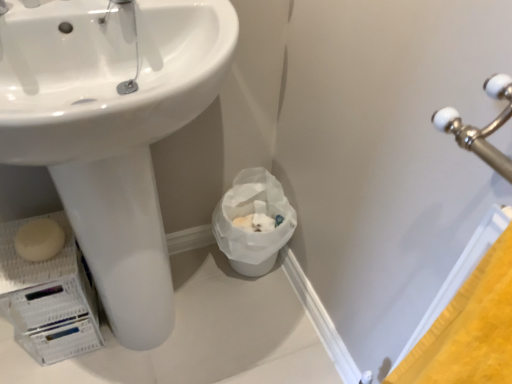
Describe the element at coordinates (39, 240) in the screenshot. I see `white matte soap at lower left` at that location.

From the picture: Measure the distance between white glossy sink at center and camera.

white glossy sink at center is 17.40 inches away from camera.

In order to face white paper bag at lower center, should I rotate leftwards or rightwards?

To align with it, rotate left about 0.578°.

Where is `white matte soap at lower left`? white matte soap at lower left is located at coordinates (39, 240).

From a real-world perspective, is white matte soap at lower left on white glossy sink at center?

Actually, white matte soap at lower left is physically below white glossy sink at center in the real world.

How many degrees apart are the facing directions of white matte soap at lower left and white glossy sink at center?

The angle between the facing direction of white matte soap at lower left and the facing direction of white glossy sink at center is 0.831 degrees.

From the image's perspective, is white matte soap at lower left over white glossy sink at center?

Incorrect, from the image's perspective, white matte soap at lower left is lower than white glossy sink at center.

Is white glossy sink at center with white matte soap at lower left?

No, white glossy sink at center is not in contact with white matte soap at lower left.

Could white matte soap at lower left be considered to be inside white glossy sink at center?

Indeed, white matte soap at lower left is located within white glossy sink at center.

Considering the points (36, 149) and (35, 242), which point is in front, point (36, 149) or point (35, 242)?

Positioned in front is point (36, 149).

Which of these two, white glossy sink at center or white matte soap at lower left, is thinner?

white matte soap at lower left.

Does white paper bag at lower center have a larger size compared to white glossy sink at center?

No, white paper bag at lower center is not bigger than white glossy sink at center.

Which object is closer to the camera, white paper bag at lower center or white glossy sink at center?

Positioned in front is white glossy sink at center.

Considering the relative positions of white paper bag at lower center and white glossy sink at center in the image provided, is white paper bag at lower center to the right of white glossy sink at center from the viewer's perspective?

Yes.

I want to click on sink that appears above the white paper bag at lower center (from a real-world perspective), so click(111, 130).

This screenshot has height=384, width=512. I want to click on garbage below the white matte soap at lower left (from the image's perspective), so click(x=252, y=213).

From the picture: Is white matte soap at lower left situated inside white paper bag at lower center or outside?

white matte soap at lower left is outside white paper bag at lower center.

From the image's perspective, is white matte soap at lower left beneath white paper bag at lower center?

No.

From a real-world perspective, which object stands above the other?

white matte soap at lower left.

Can you confirm if white paper bag at lower center is taller than white matte soap at lower left?

Indeed, white paper bag at lower center has a greater height compared to white matte soap at lower left.

I want to click on soap on the left side of white paper bag at lower center, so click(39, 240).

Can white paper bag at lower center be found inside white glossy sink at center?

No, white paper bag at lower center is not inside white glossy sink at center.

Considering the sizes of objects white glossy sink at center and white paper bag at lower center in the image provided, who is taller, white glossy sink at center or white paper bag at lower center?

white glossy sink at center is taller.

In the scene shown: Which is behind, white glossy sink at center or white paper bag at lower center?

white paper bag at lower center is more distant.

From the image's perspective, is white glossy sink at center located above or below white paper bag at lower center?

white glossy sink at center is above white paper bag at lower center.

At what (x,y) coordinates should I click in order to perform the action: click on sink on the right of white matte soap at lower left. Please return your answer as a coordinate pair (x, y). The width and height of the screenshot is (512, 384). Looking at the image, I should click on (111, 130).

Where is `sink that is in front of the white matte soap at lower left`? sink that is in front of the white matte soap at lower left is located at coordinates (111, 130).

When comparing their distances from white glossy sink at center, does white paper bag at lower center or white matte soap at lower left seem closer?

Based on the image, white matte soap at lower left appears to be nearer to white glossy sink at center.

Considering their positions, is white glossy sink at center positioned closer to white paper bag at lower center than white matte soap at lower left?

Based on the image, white glossy sink at center appears to be nearer to white paper bag at lower center.

Considering their positions, is white paper bag at lower center positioned closer to white matte soap at lower left than white glossy sink at center?

white glossy sink at center.

From the image, which object appears to be nearer to white glossy sink at center, white matte soap at lower left or white paper bag at lower center?

white matte soap at lower left.

Which object lies further to the anchor point white matte soap at lower left, white glossy sink at center or white paper bag at lower center?

white paper bag at lower center is further to white matte soap at lower left.

Estimate the real-world distances between objects in this image. Which object is closer to white paper bag at lower center, white matte soap at lower left or white glossy sink at center?

white glossy sink at center.

In order to click on soap between white glossy sink at center and white paper bag at lower center along the z-axis in this screenshot , I will do `click(39, 240)`.